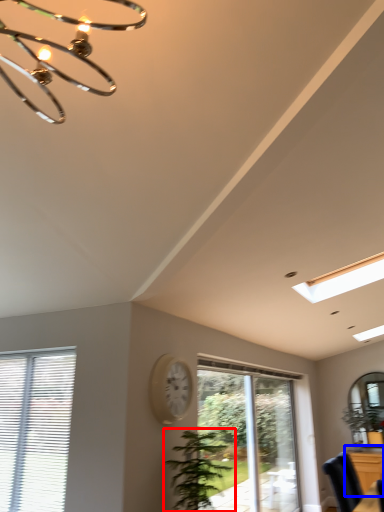
Question: Which object appears farthest to the camera in this image, houseplant (highlighted by a red box) or dresser (highlighted by a blue box)?

Choices:
 (A) houseplant
 (B) dresser

Answer: (B)